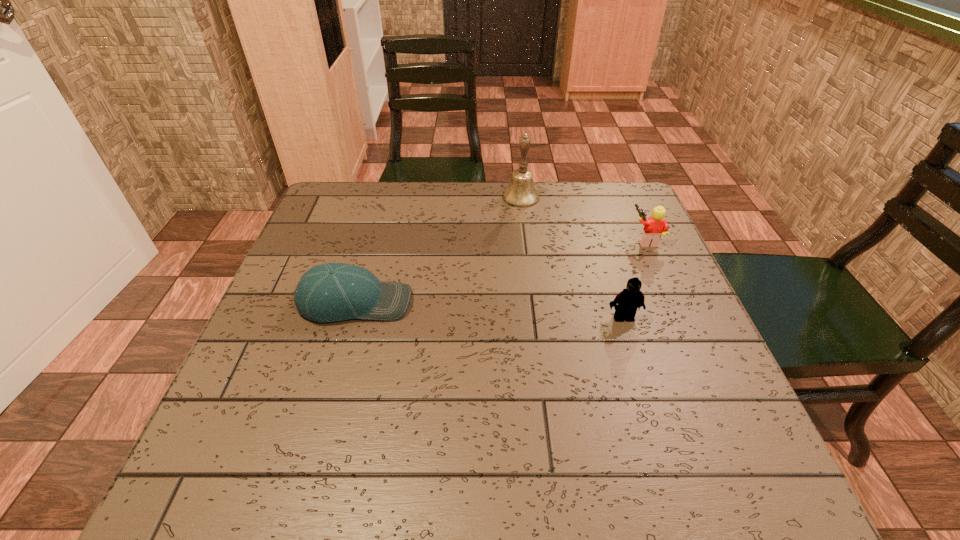
In the image, there is a desktop. Where is `vacant space at the left edge`? This screenshot has height=540, width=960. vacant space at the left edge is located at coordinates (310, 350).

The height and width of the screenshot is (540, 960). Find the location of `free region at the right edge`. free region at the right edge is located at coordinates (660, 260).

The height and width of the screenshot is (540, 960). Identify the location of vacant area at the far left corner of the desktop. (367, 208).

I want to click on free space at the far right corner of the desktop, so click(x=614, y=183).

Locate an element on the screen. Image resolution: width=960 pixels, height=540 pixels. unoccupied area between the tallest object and the shortest object is located at coordinates (438, 249).

The height and width of the screenshot is (540, 960). Identify the location of free spot between the third object from left to right and the leftmost object. point(490,310).

Locate an element on the screen. This screenshot has width=960, height=540. empty space that is in between the right Lego and the shortest object is located at coordinates (500, 271).

The height and width of the screenshot is (540, 960). Identify the location of free space between the third object from right to left and the nearer Lego. (572, 258).

What are the coordinates of `free area in between the nearer Lego and the leftmost object` in the screenshot? It's located at (490, 310).

Identify the location of free space between the shortest object and the left Lego. (490, 310).